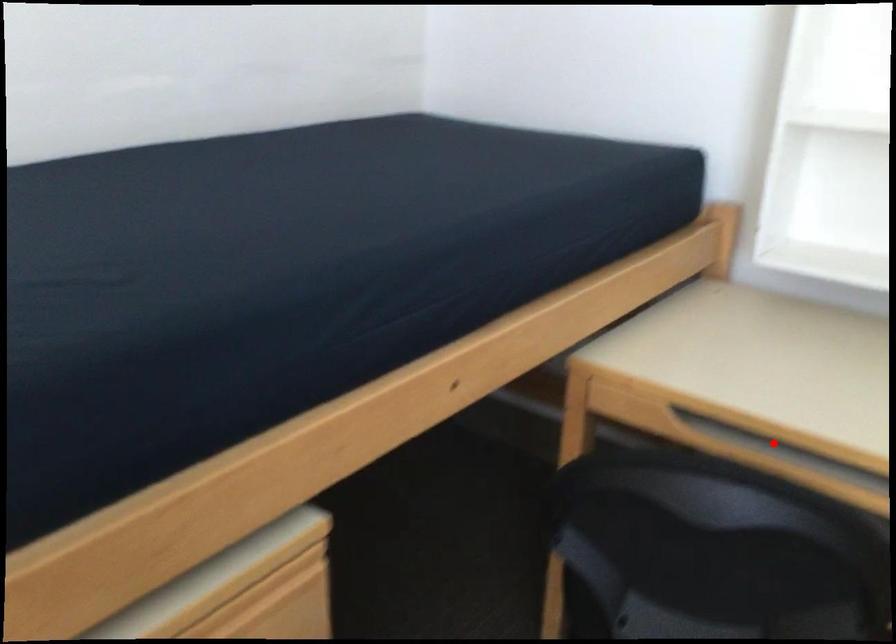
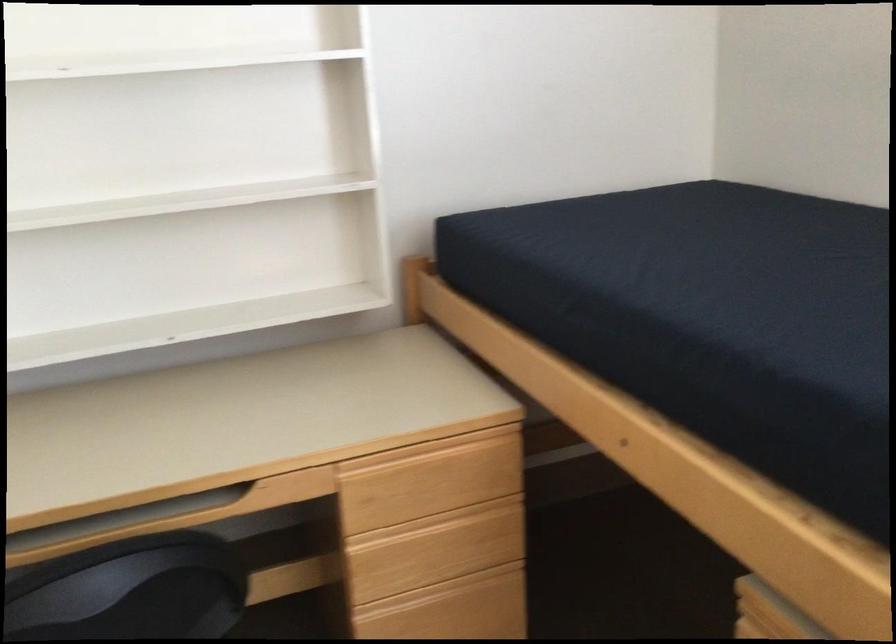
Where in the second image is the point corresponding to the highlighted location from the first image?

(96, 529)